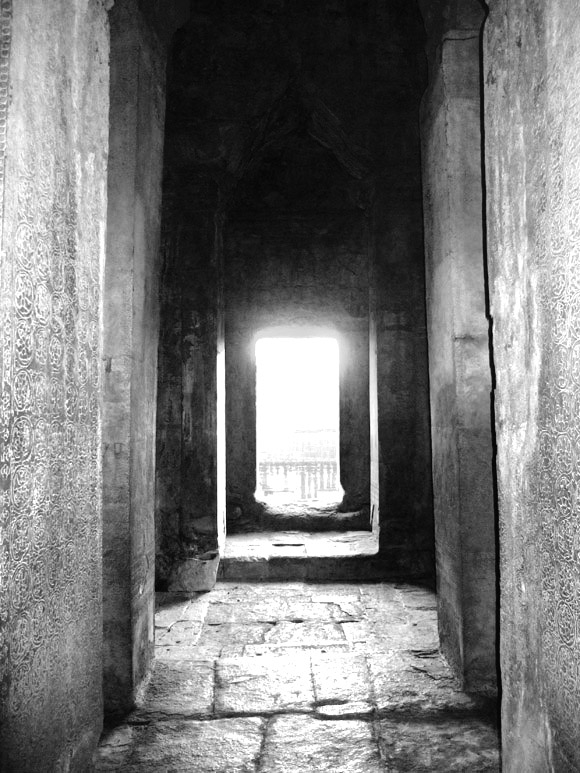
The width and height of the screenshot is (580, 773). In order to click on bright light in this screenshot , I will do `click(298, 373)`.